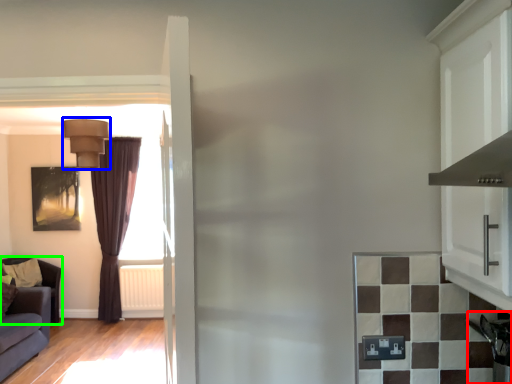
Question: Considering the real-world distances, which object is farthest from appliance (highlighted by a red box)? light fixture (highlighted by a blue box) or furniture (highlighted by a green box)?

Choices:
 (A) light fixture
 (B) furniture

Answer: (B)